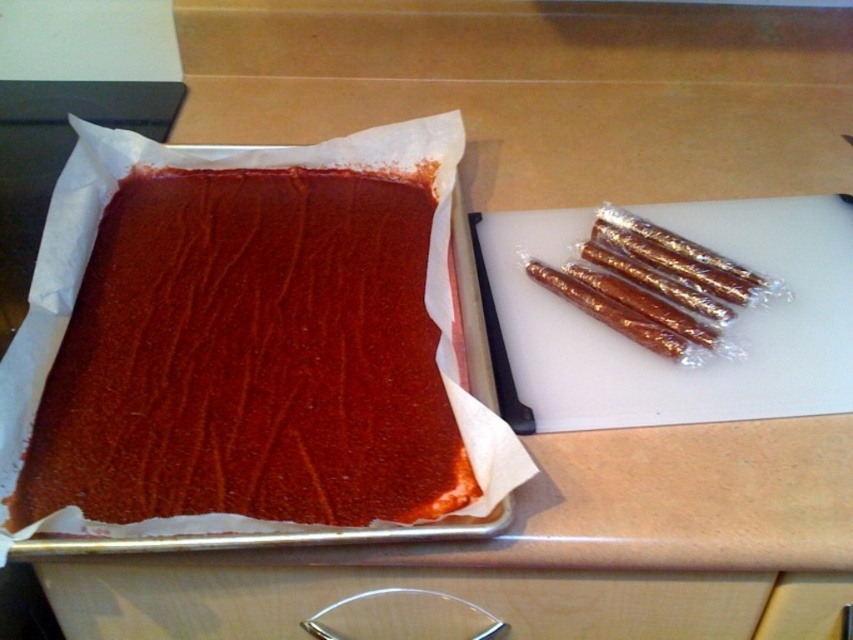
Question: Is wooden drawer handle at lower center to the right of translucent plastic sticks at right from the viewer's perspective?

Choices:
 (A) no
 (B) yes

Answer: (A)

Question: Which point is closer to the camera taking this photo?

Choices:
 (A) (44, 576)
 (B) (225, 321)

Answer: (A)

Question: Which point is closer to the camera taking this photo?

Choices:
 (A) (635, 336)
 (B) (718, 586)

Answer: (B)

Question: Which of the following is the closest to the observer?

Choices:
 (A) (370, 580)
 (B) (711, 316)

Answer: (A)

Question: Is smooth chocolate cake at center to the right of wooden drawer handle at lower center from the viewer's perspective?

Choices:
 (A) no
 (B) yes

Answer: (A)

Question: Does smooth chocolate cake at center come behind wooden drawer handle at lower center?

Choices:
 (A) yes
 (B) no

Answer: (B)